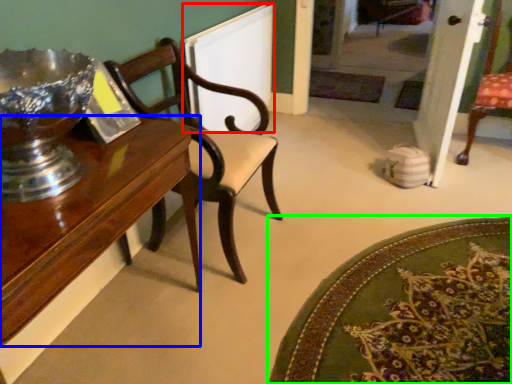
Question: Which object is the closest to the radiator (highlighted by a red box)? Choose among these: table (highlighted by a blue box) or mat (highlighted by a green box).

Choices:
 (A) table
 (B) mat

Answer: (A)